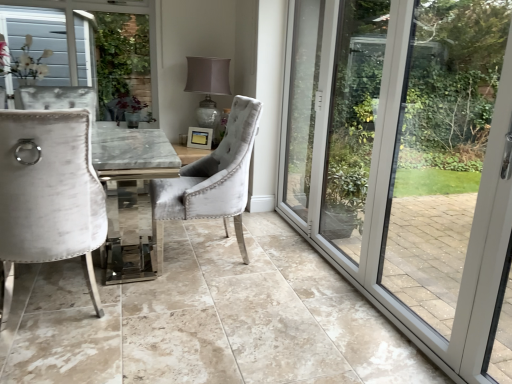
Identify the location of vacant area that lies between transparent glass door at right and velvet white chair at left, acting as the second chair starting from the right. This screenshot has width=512, height=384. (245, 299).